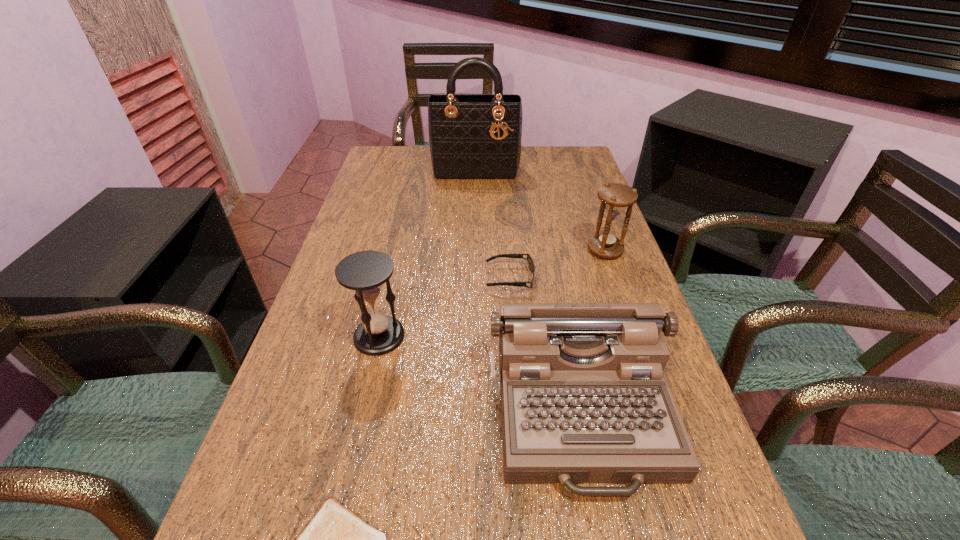
Locate an element on the screen. This screenshot has height=540, width=960. handbag is located at coordinates (474, 137).

Find the location of a particular element. the tallest object is located at coordinates (474, 137).

Identify the location of the nearer hourglass. The height and width of the screenshot is (540, 960). (365, 272).

You are a GUI agent. You are given a task and a screenshot of the screen. Output one action in this format:
    pyautogui.click(x=<x>, y=<y>)
    Task: Click on the right hourglass
    Image resolution: width=960 pixels, height=540 pixels.
    Given the screenshot: What is the action you would take?
    pyautogui.click(x=615, y=197)

Locate an element on the screen. The width and height of the screenshot is (960, 540). the farther hourglass is located at coordinates (615, 197).

Identify the location of typewriter. The height and width of the screenshot is (540, 960). (584, 398).

The image size is (960, 540). Identify the location of the fifth tallest object. (530, 262).

Identify the location of sunglasses. Image resolution: width=960 pixels, height=540 pixels. (530, 262).

Identify the location of vacant space located at the front of the farthest object with visible charms. The height and width of the screenshot is (540, 960). (474, 246).

Find the location of a particular element. vacant region located on the right of the nearer hourglass is located at coordinates (521, 336).